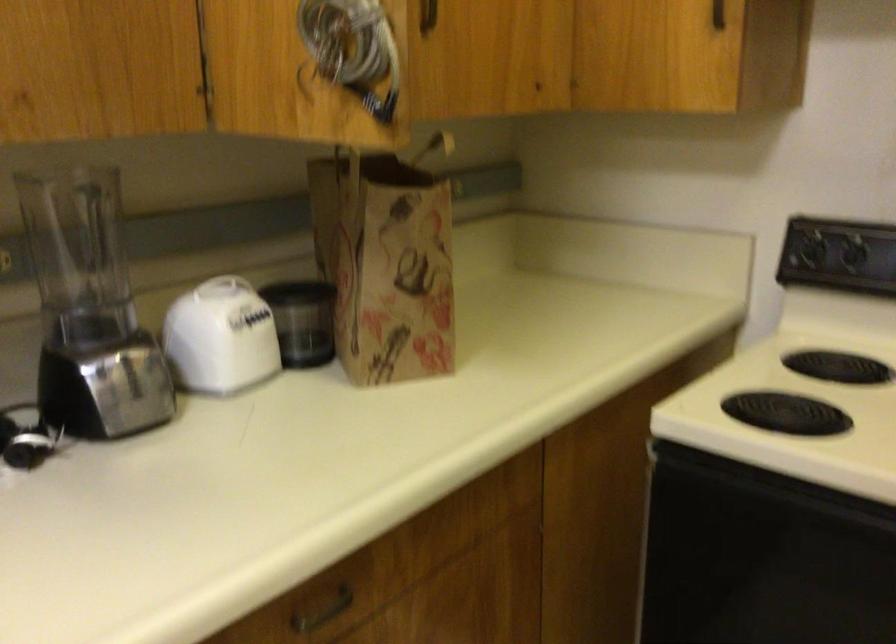
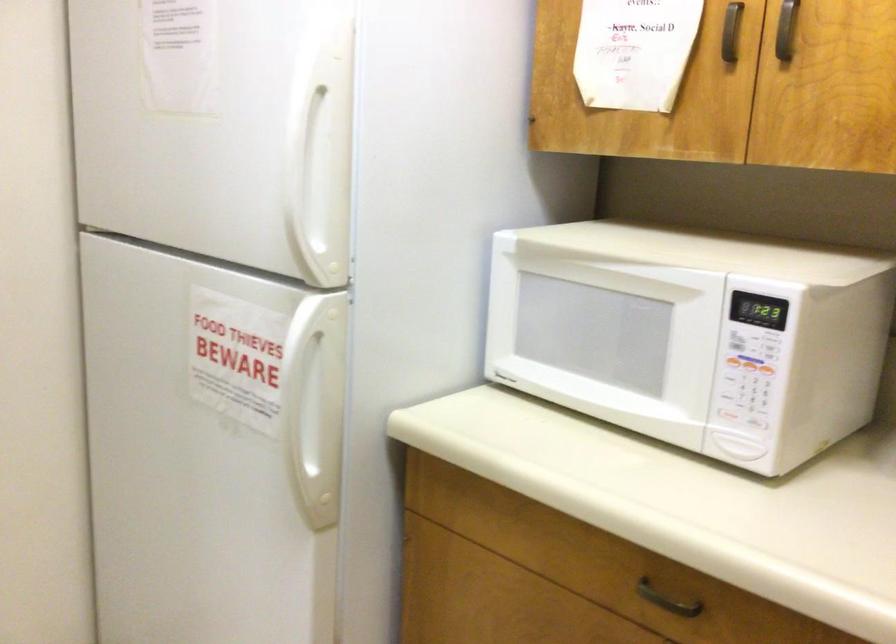
Based on the continuous images, in which direction is the camera rotating?

The camera's rotation is toward left-down.